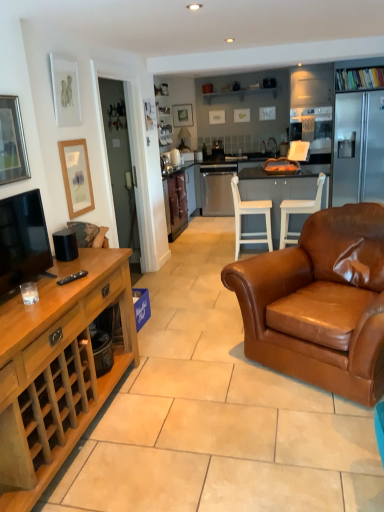
Find the location of `free spot above wooden cabinet at left, arranged as the 1th cabinetry when ordered from the bottom (from a real-world perspective)`. free spot above wooden cabinet at left, arranged as the 1th cabinetry when ordered from the bottom (from a real-world perspective) is located at coordinates (46, 288).